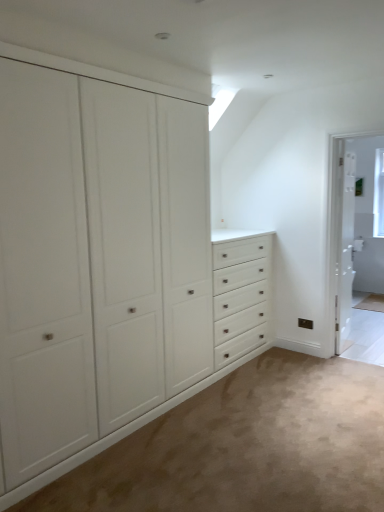
Question: Is white matte cabinet at left wider or thinner than white wooden screen door at right?

Choices:
 (A) thin
 (B) wide

Answer: (B)

Question: From the image's perspective, relative to white wooden screen door at right, is white matte cabinet at left above or below?

Choices:
 (A) below
 (B) above

Answer: (A)

Question: Which object is the closest to the white matte cabinet at left?

Choices:
 (A) white wooden screen door at right
 (B) white glossy door at right

Answer: (A)

Question: Which object is the farthest from the white matte cabinet at left?

Choices:
 (A) white glossy door at right
 (B) white wooden screen door at right

Answer: (A)